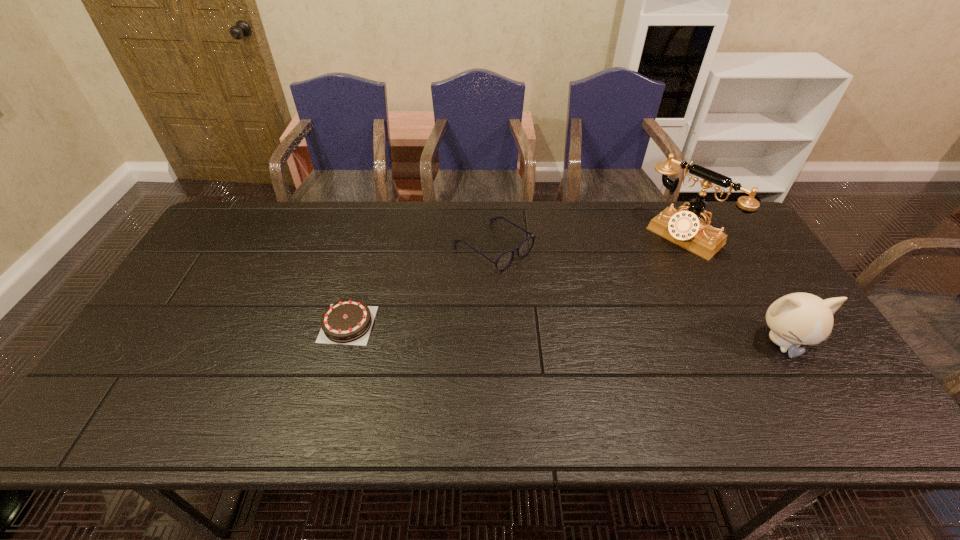
In order to click on free space at the near edge in this screenshot , I will do `click(287, 383)`.

In the image, there is a desktop. In order to click on vacant space at the right edge in this screenshot , I will do `click(756, 303)`.

Locate an element on the screen. The width and height of the screenshot is (960, 540). vacant space at the near left corner is located at coordinates (150, 394).

Locate an element on the screen. free space at the far right corner is located at coordinates (728, 210).

Locate an element on the screen. free space that is in between the tallest object and the third tallest object is located at coordinates (588, 241).

This screenshot has width=960, height=540. What are the coordinates of `vacant area that lies between the shortest object and the tallest object` in the screenshot? It's located at (516, 280).

The image size is (960, 540). What are the coordinates of `unoccupied position between the leftmost object and the tallest object` in the screenshot? It's located at click(516, 280).

Where is `free space between the third tallest object and the kitten`? The width and height of the screenshot is (960, 540). free space between the third tallest object and the kitten is located at coordinates (637, 295).

Where is `free space between the third shortest object and the shortest object`? This screenshot has height=540, width=960. free space between the third shortest object and the shortest object is located at coordinates (564, 333).

Image resolution: width=960 pixels, height=540 pixels. Identify the location of free point between the telephone and the second tallest object. (732, 288).